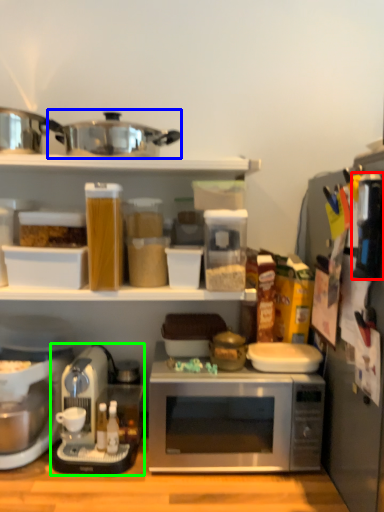
Question: Considering the real-world distances, which object is closest to appliance (highlighted by a red box)? crock pot (highlighted by a blue box) or coffee maker (highlighted by a green box).

Choices:
 (A) crock pot
 (B) coffee maker

Answer: (A)